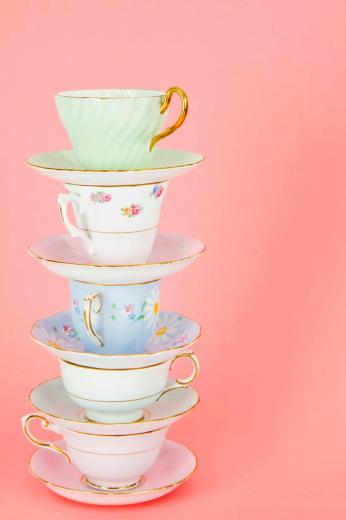
Identify the location of floral design tea cup. (141, 318), (125, 217).